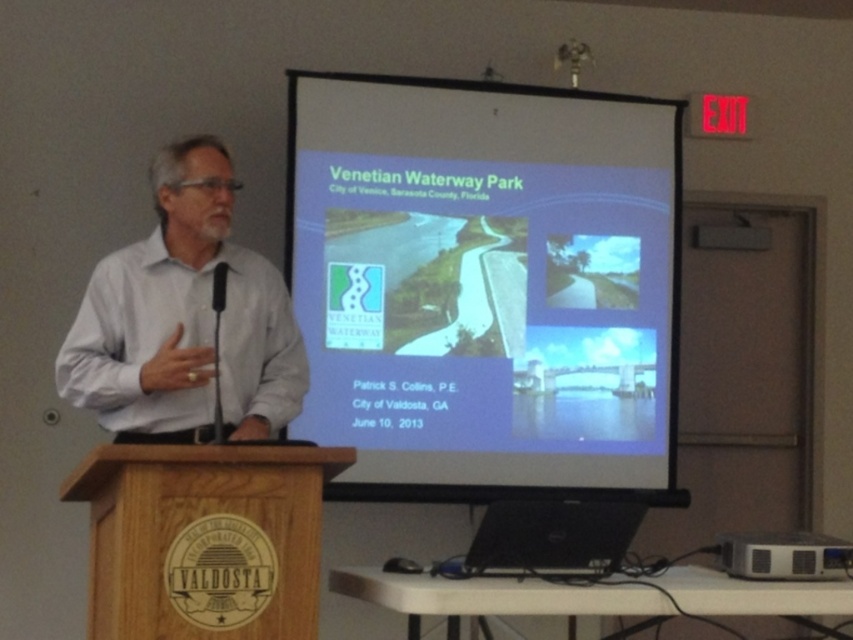
Question: Can you confirm if white matte projection screen at center is thinner than white shirt at left?

Choices:
 (A) no
 (B) yes

Answer: (A)

Question: Is white matte projection screen at center wider than black plastic projector at lower right?

Choices:
 (A) no
 (B) yes

Answer: (B)

Question: Which point is closer to the camera taking this photo?

Choices:
 (A) (645, 308)
 (B) (720, 538)
 (C) (241, 352)

Answer: (C)

Question: Which of these objects is positioned farthest from the white shirt at left?

Choices:
 (A) white matte projection screen at center
 (B) black plastic projector at lower right

Answer: (B)

Question: Which object is positioned farthest from the white shirt at left?

Choices:
 (A) black plastic projector at lower right
 (B) white matte projection screen at center

Answer: (A)

Question: Can you confirm if white shirt at left is wider than black plastic projector at lower right?

Choices:
 (A) yes
 (B) no

Answer: (A)